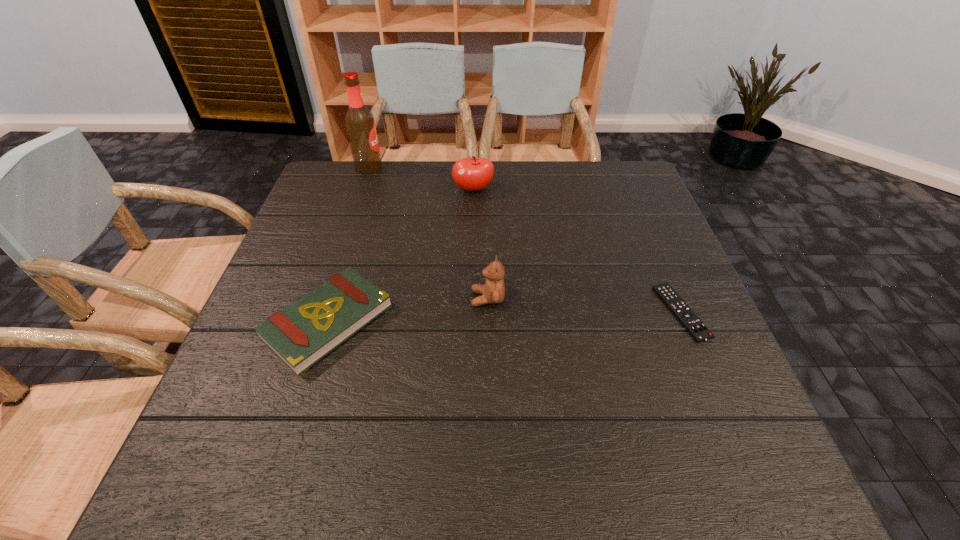
Image resolution: width=960 pixels, height=540 pixels. Identify the location of free space located 0.310m on the face of the teddy bear. (332, 298).

Find the location of a particular element. Image resolution: width=960 pixels, height=540 pixels. free location located 0.330m on the face of the teddy bear is located at coordinates (324, 298).

I want to click on free region located 0.200m on the back of the fourth tallest object, so click(358, 224).

The image size is (960, 540). In order to click on vacant position located on the left of the shortest object in this screenshot , I will do `click(634, 312)`.

Locate an element on the screen. This screenshot has width=960, height=540. beer bottle that is at the far edge is located at coordinates (360, 124).

The height and width of the screenshot is (540, 960). What are the coordinates of `apple located at the far edge` in the screenshot? It's located at (474, 173).

I want to click on beer bottle present at the left edge, so click(x=360, y=124).

Find the location of `book that is at the left edge`. book that is at the left edge is located at coordinates (301, 334).

Image resolution: width=960 pixels, height=540 pixels. Identify the location of object present at the right edge. (697, 329).

You are a GUI agent. You are given a task and a screenshot of the screen. Output one action in this format:
    pyautogui.click(x=<x>, y=<y>)
    Task: Click on the object positioned at the far left corner
    This screenshot has width=960, height=540.
    Given the screenshot: What is the action you would take?
    pyautogui.click(x=360, y=124)